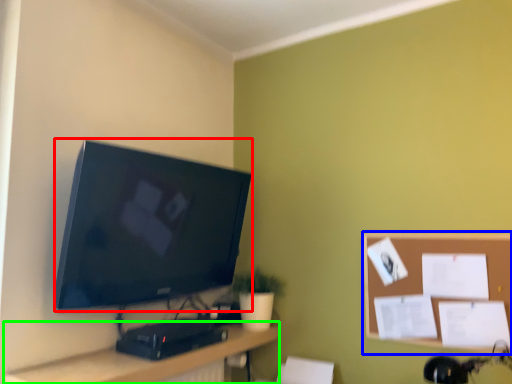
Question: Which object is positioned closest to television (highlighted by a red box)? Select from bulletin board (highlighted by a blue box) and desk (highlighted by a green box).

Choices:
 (A) bulletin board
 (B) desk

Answer: (B)